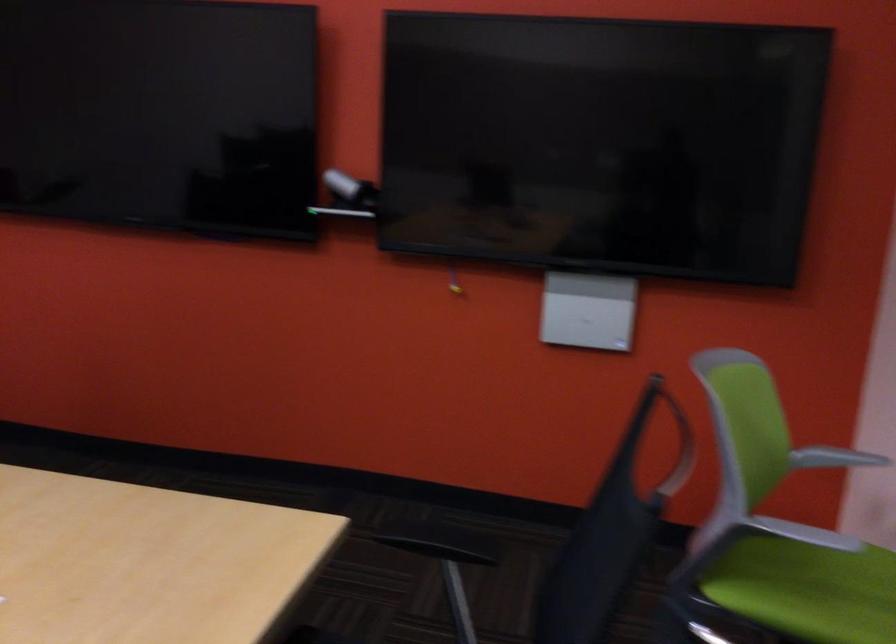
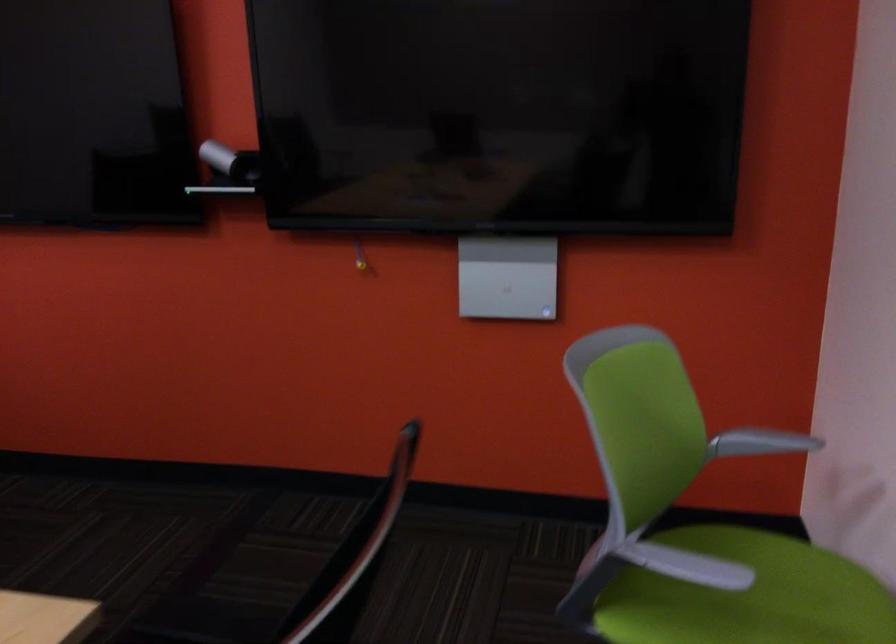
In the second image, find the point that corresponds to [354,187] in the first image.

(230, 162)